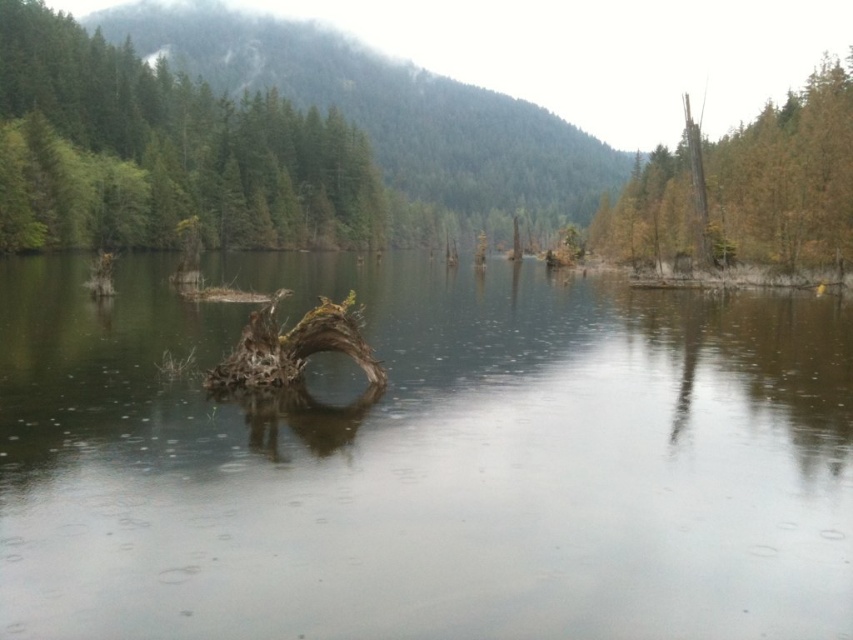
You are a kayaker planning to paddle through the scene. You need to know if the transparent water at center is deeper than the brown rough tree trunk at right to avoid hitting it. Can you determine this based on the information provided?

A: The transparent water at center is not as tall as the brown rough tree trunk at right, which means the water is shallower than the tree trunk. Therefore, the transparent water at center is not deeper than the brown rough tree trunk at right, so you might hit it if you try to pass over it.